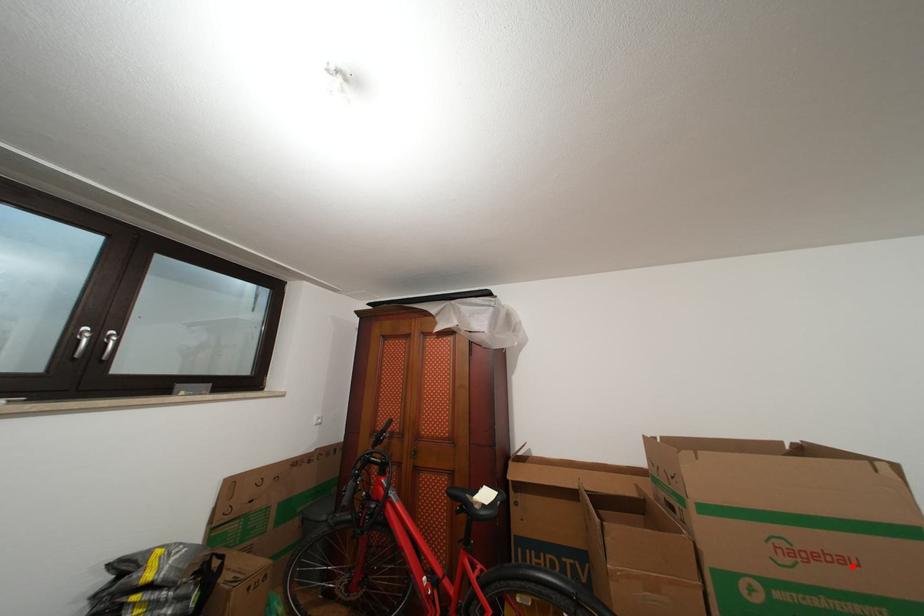
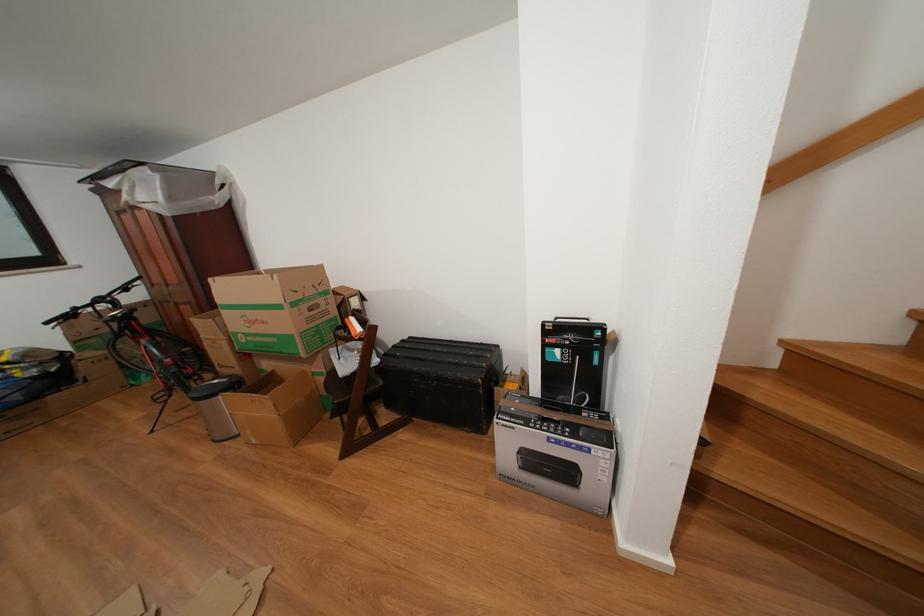
Question: A red point is marked in image1. In image2, is the corresponding 3D point closer to the camera or farther? Reply with the corresponding letter.

Choices:
 (A) The corresponding 3D point is closer.
 (B) The corresponding 3D point is farther.

Answer: (B)